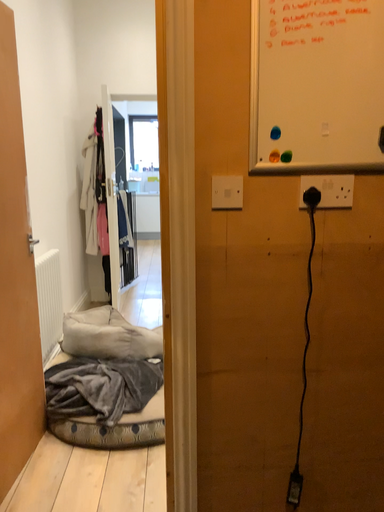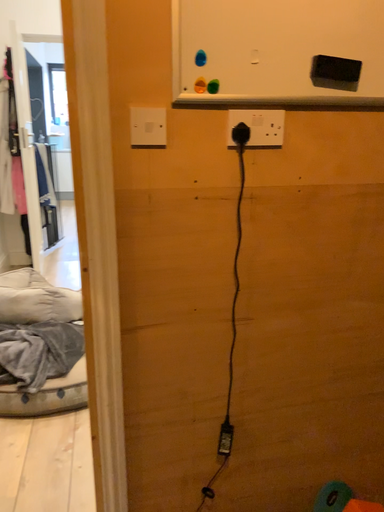
Question: How did the camera likely rotate when shooting the video?

Choices:
 (A) rotated right
 (B) rotated left

Answer: (A)